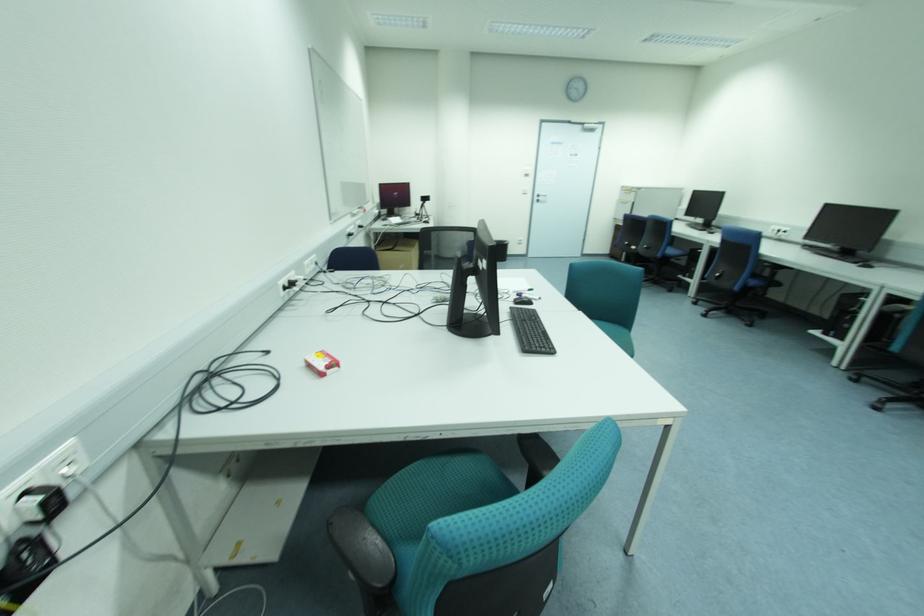
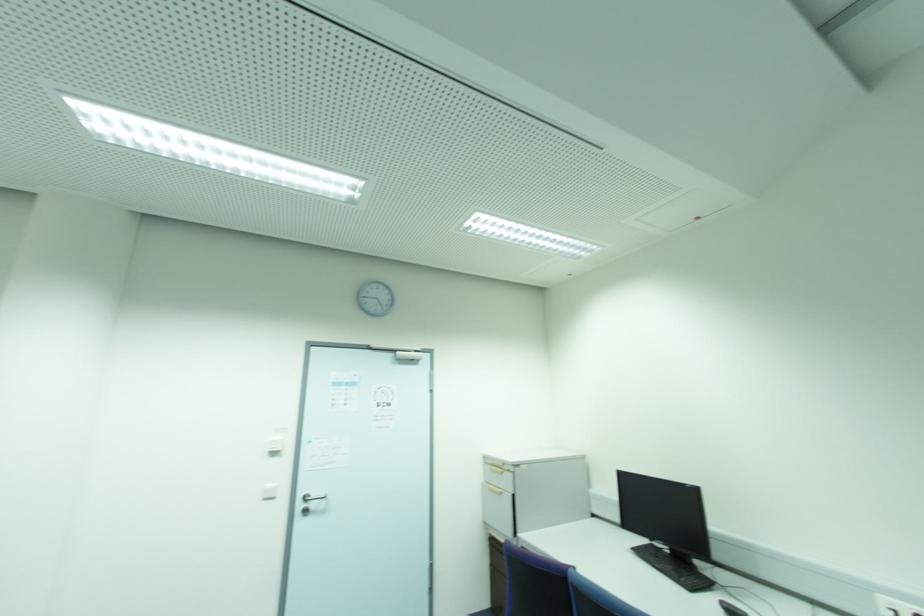
In the second image, find the point that corresponds to [627,203] in the first image.

(502, 493)